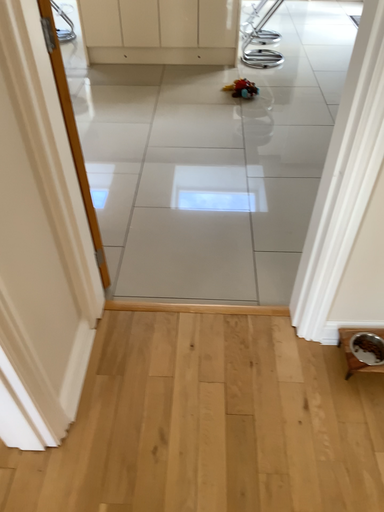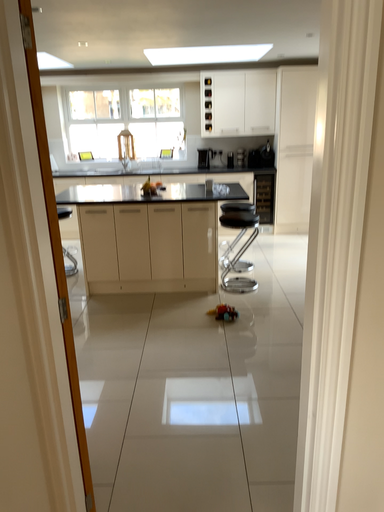
Question: Which way did the camera rotate in the video?

Choices:
 (A) rotated upward
 (B) rotated downward

Answer: (A)